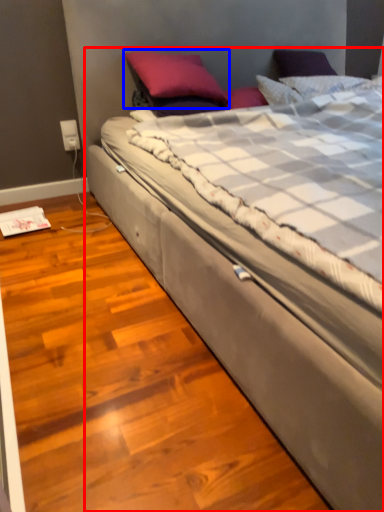
Question: Which object appears closest to the camera in this image, bed (highlighted by a red box) or pillow (highlighted by a blue box)?

Choices:
 (A) bed
 (B) pillow

Answer: (A)